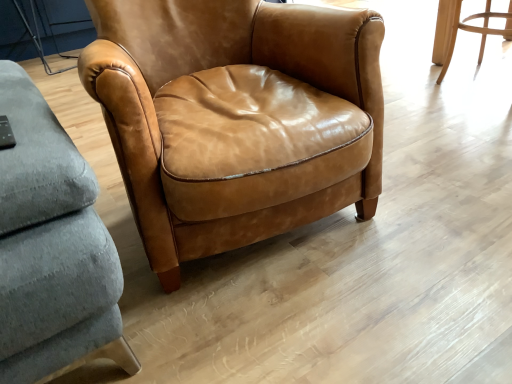
Question: Should I look upward or downward to see matte brown leather chair at center, acting as the 1th chair starting from the back?

Choices:
 (A) down
 (B) up

Answer: (B)

Question: Which direction should I rotate to face matte leather chair at center, arranged as the first chair when viewed from the front, — up or down?

Choices:
 (A) down
 (B) up

Answer: (B)

Question: Is matte leather chair at center, arranged as the first chair when viewed from the front, at the left side of matte brown leather chair at center, acting as the 1th chair starting from the right?

Choices:
 (A) yes
 (B) no

Answer: (A)

Question: From a real-world perspective, is matte leather chair at center, placed as the 1th chair when sorted from left to right, over matte brown leather chair at center, the 2th chair from the left?

Choices:
 (A) no
 (B) yes

Answer: (B)

Question: Is matte leather chair at center, arranged as the first chair when viewed from the front, beside matte brown leather chair at center, the 2th chair from the left?

Choices:
 (A) yes
 (B) no

Answer: (B)

Question: Is matte leather chair at center, placed as the 1th chair when sorted from left to right, behind matte brown leather chair at center, acting as the 1th chair starting from the right?

Choices:
 (A) yes
 (B) no

Answer: (B)

Question: From the image's perspective, is matte leather chair at center, placed as the 1th chair when sorted from left to right, under matte brown leather chair at center, the 2th chair from the left?

Choices:
 (A) yes
 (B) no

Answer: (A)

Question: From the image's perspective, does matte leather chair at center, arranged as the first chair when viewed from the front, appear higher than matte brown leather chair at center, acting as the 1th chair starting from the right?

Choices:
 (A) yes
 (B) no

Answer: (B)

Question: Is matte brown leather chair at center, acting as the 1th chair starting from the back, closer to camera compared to matte leather chair at center, the second chair in the right-to-left sequence?

Choices:
 (A) yes
 (B) no

Answer: (B)

Question: Is matte leather chair at center, which appears as the 2th chair when viewed from the back, located within matte brown leather chair at center, acting as the 1th chair starting from the back?

Choices:
 (A) yes
 (B) no

Answer: (B)

Question: From a real-world perspective, is matte brown leather chair at center, marked as the second chair in a front-to-back arrangement, physically above matte leather chair at center, placed as the 1th chair when sorted from left to right?

Choices:
 (A) no
 (B) yes

Answer: (A)

Question: Is matte brown leather chair at center, acting as the 1th chair starting from the right, touching matte leather chair at center, which appears as the 2th chair when viewed from the back?

Choices:
 (A) no
 (B) yes

Answer: (A)

Question: Is matte brown leather chair at center, the 2th chair from the left, facing away from matte leather chair at center, the second chair in the right-to-left sequence?

Choices:
 (A) no
 (B) yes

Answer: (B)

Question: Considering the relative positions of matte brown leather chair at center, marked as the second chair in a front-to-back arrangement, and matte leather chair at center, which appears as the 2th chair when viewed from the back, in the image provided, is matte brown leather chair at center, marked as the second chair in a front-to-back arrangement, behind matte leather chair at center, which appears as the 2th chair when viewed from the back,?

Choices:
 (A) no
 (B) yes

Answer: (B)

Question: Is matte brown leather chair at center, acting as the 1th chair starting from the back, inside the boundaries of matte leather chair at center, which appears as the 2th chair when viewed from the back, or outside?

Choices:
 (A) inside
 (B) outside

Answer: (B)